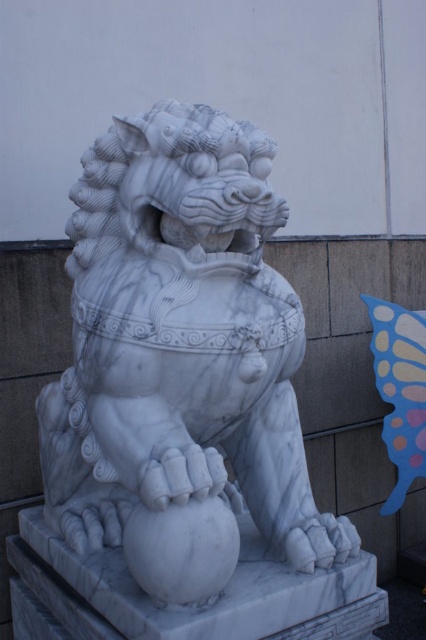
You are an artist standing at the base of the white marble lion at center, holding a paintbrush. You want to paint the blue paper butterfly at upper right without moving your feet. Can you reach it with your longest arm extension of 1.1 meters?

The distance between the white marble lion at center and the blue paper butterfly at upper right is 1.20 meters. Since your arm can only extend 1.1 meters, you cannot reach the blue paper butterfly at upper right from your current position.

From the picture: You are an art conservator examining the statue. You notice two points on the statue marked at coordinates point (89, 211) and point (400, 372). Which point is positioned closer to your viewpoint?

Point (89, 211) is closer to the viewer than point (400, 372).

From the picture: You are an art conservator examining the statue of the white marble lion at center and the blue paper butterfly at upper right. Which object is positioned closer to your viewpoint?

The white marble lion at center is closer to the viewer than the blue paper butterfly at upper right.